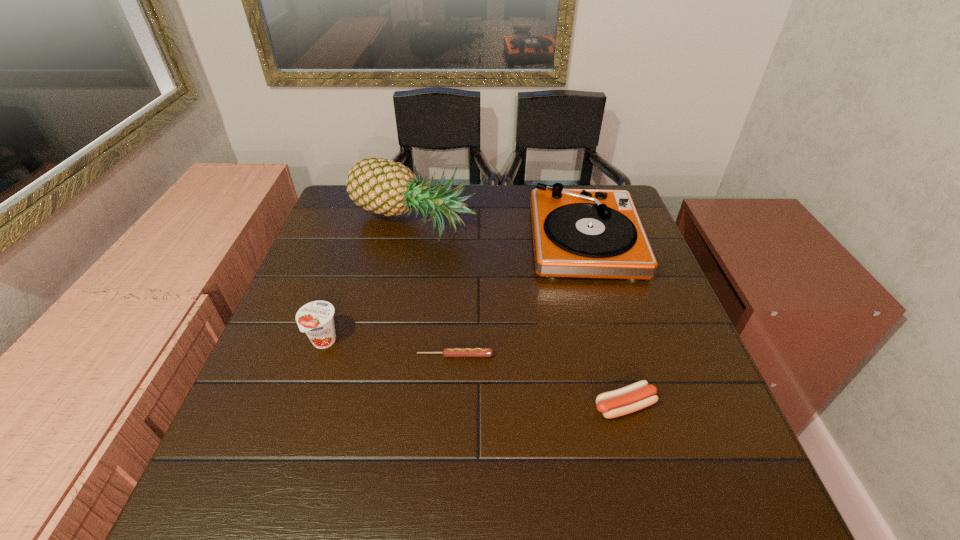
I want to click on vacant space located 0.220m on the left of the taller sausage, so (x=479, y=406).

Where is `free space located on the right of the left sausage`? This screenshot has height=540, width=960. free space located on the right of the left sausage is located at coordinates (516, 355).

The width and height of the screenshot is (960, 540). I want to click on pineapple present at the far edge, so click(x=382, y=186).

Where is `record player that is at the far edge`? record player that is at the far edge is located at coordinates (585, 233).

Locate an element on the screen. The width and height of the screenshot is (960, 540). pineapple at the left edge is located at coordinates (382, 186).

Where is `yogurt that is positioned at the left edge`? yogurt that is positioned at the left edge is located at coordinates (316, 319).

Locate an element on the screen. Image resolution: width=960 pixels, height=540 pixels. record player at the right edge is located at coordinates (585, 233).

At what (x,y) coordinates should I click in order to perform the action: click on sausage located in the right edge section of the desktop. Please return your answer as a coordinate pair (x, y). Image resolution: width=960 pixels, height=540 pixels. Looking at the image, I should click on pyautogui.click(x=636, y=396).

What are the coordinates of `object that is at the far left corner` in the screenshot? It's located at (382, 186).

Identify the location of object positioned at the far right corner. (585, 233).